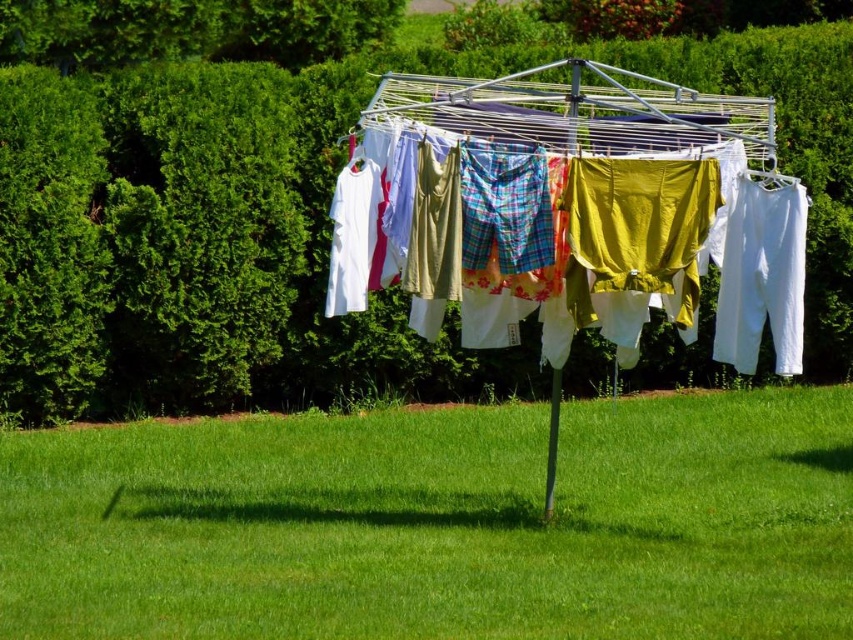
Is green grass at center taller than matte yellow fabric at center?

No, green grass at center is not taller than matte yellow fabric at center.

Who is shorter, green grass at center or matte yellow fabric at center?

With less height is green grass at center.

Does point (283, 614) come in front of point (592, 320)?

That is True.

This screenshot has width=853, height=640. In order to click on green grass at center in this screenshot , I will do `click(439, 524)`.

Who is shorter, green leafy hedge at upper center or matte yellow fabric at center?

matte yellow fabric at center is shorter.

Does point (805, 131) lie in front of point (625, 160)?

That is False.

Identify the location of green leafy hedge at upper center. (305, 224).

Is plaid fabric shorts at center above white cotton pants at right?

Indeed, plaid fabric shorts at center is positioned over white cotton pants at right.

Which is more to the right, plaid fabric shorts at center or white cotton pants at right?

white cotton pants at right

Who is more forward, [611,337] or [769,243]?

Point [769,243] is more forward.

Locate an element on the screen. The image size is (853, 640). plaid fabric shorts at center is located at coordinates [756, 264].